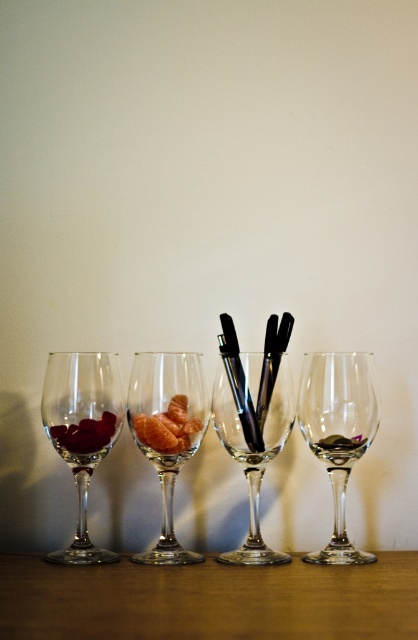
Question: Observing the image, what is the correct spatial positioning of transparent glass at left in reference to orange flesh at center?

Choices:
 (A) right
 (B) left

Answer: (B)

Question: Where is transparent glass pens at center located in relation to transparent glass at center in the image?

Choices:
 (A) right
 (B) left

Answer: (B)

Question: Estimate the real-world distances between objects in this image. Which object is farther from the transparent glass at center?

Choices:
 (A) transparent glass pens at center
 (B) black glossy fountain pen at center
 (C) shiny red grapes at left
 (D) wooden table at center

Answer: (C)

Question: Which point is farther from the camera taking this photo?

Choices:
 (A) (254, 445)
 (B) (339, 452)
 (C) (407, 592)
 (D) (55, 429)

Answer: (D)

Question: Among these points, which one is farthest from the camera?

Choices:
 (A) (333, 442)
 (B) (91, 449)
 (C) (112, 444)
 (D) (167, 451)

Answer: (C)

Question: Is transparent glass at left in front of transparent glass pens at center?

Choices:
 (A) yes
 (B) no

Answer: (B)